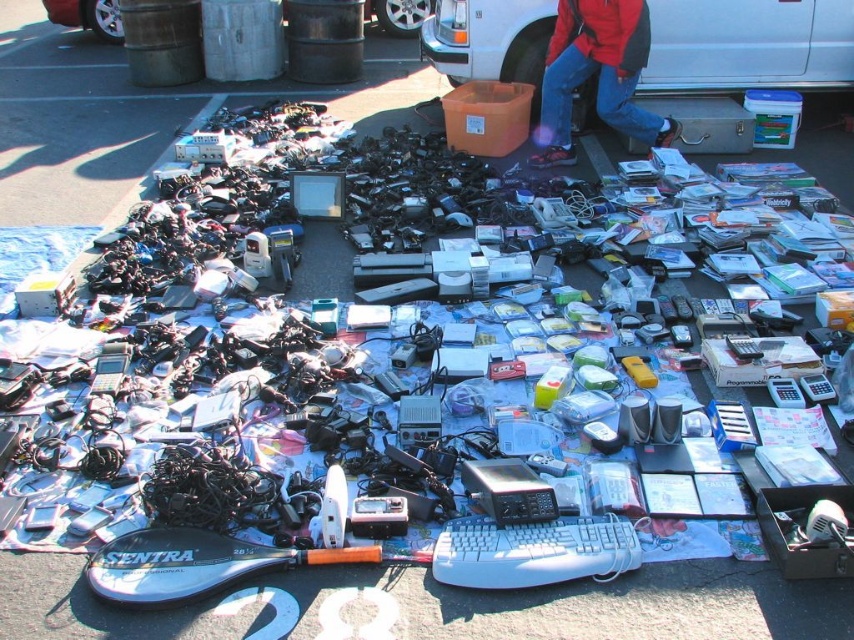
Question: Based on their relative distances, which object is nearer to the white matte van at upper right?

Choices:
 (A) silver metallic van at upper center
 (B) red fabric jacket at upper center

Answer: (B)

Question: Can you confirm if white matte van at upper right is smaller than silver metallic van at upper center?

Choices:
 (A) no
 (B) yes

Answer: (A)

Question: Which point is closer to the camera?

Choices:
 (A) silver metallic van at upper center
 (B) red fabric jacket at upper center
 (C) white matte van at upper right

Answer: (B)

Question: Is red fabric jacket at upper center to the right of silver metallic van at upper center from the viewer's perspective?

Choices:
 (A) yes
 (B) no

Answer: (A)

Question: Is white matte van at upper right in front of silver metallic van at upper center?

Choices:
 (A) no
 (B) yes

Answer: (B)

Question: Among these points, which one is farthest from the camera?

Choices:
 (A) (619, 92)
 (B) (667, 64)

Answer: (B)